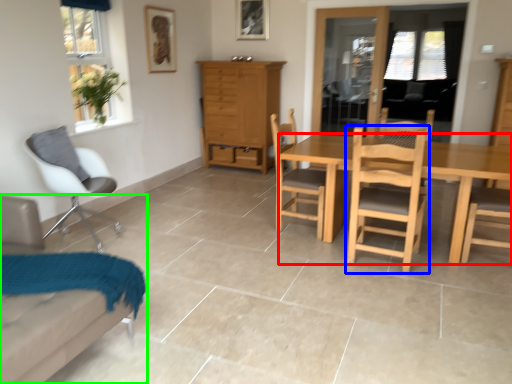
Question: Based on their relative distances, which object is nearer to desk (highlighted by a red box)? Choose from chair (highlighted by a blue box) and chair (highlighted by a green box).

Choices:
 (A) chair
 (B) chair

Answer: (A)